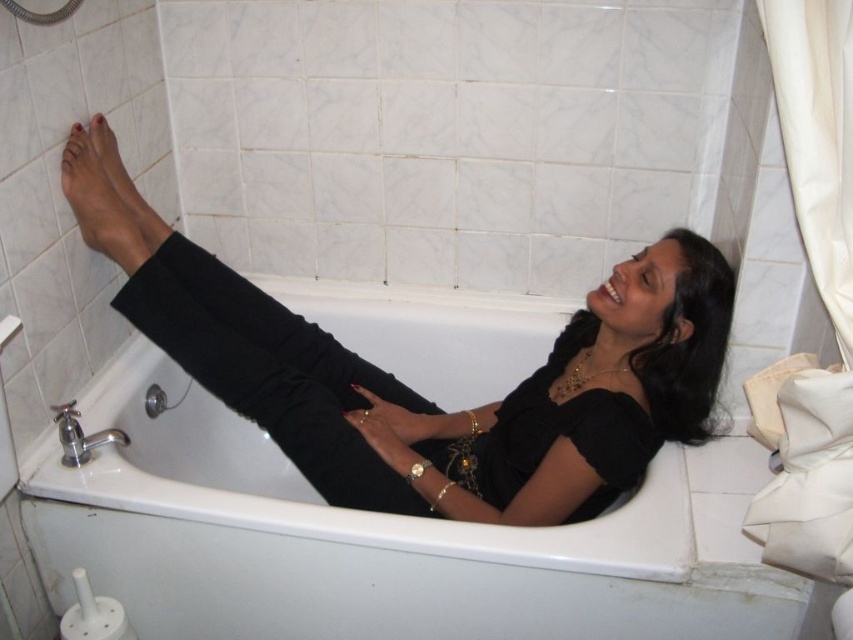
Consider the image. You are a designer creating a 3D model of the bathroom scene. You need to place the black matte pants at center in your model. What are the coordinates for their position?

The coordinates for the black matte pants at center are at point [461,410].

You are a home inspector assessing the bathroom layout. You notice the white glossy bathtub at center and the matte skin foot at upper left. Based on their heights, which one is more likely to be visible from the bathroom doorway?

The white glossy bathtub at center is much taller than the matte skin foot at upper left, so it is more likely to be visible from the bathroom doorway.